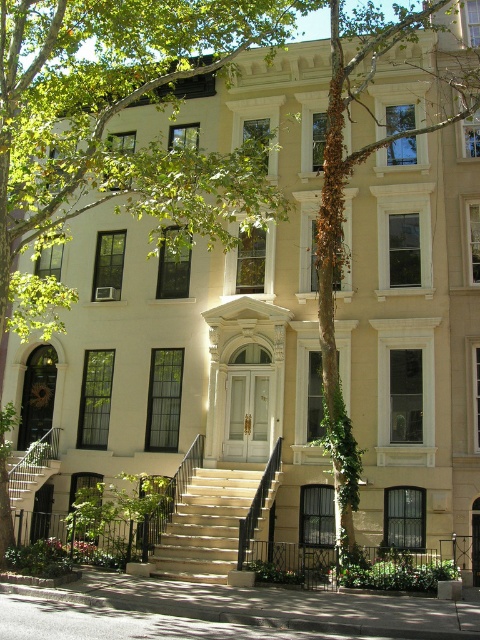
You are standing in front of the residential building and want to take a photo of both the green leafy tree at center and the metallic silver staircase at lower left. Which object should you focus on first to ensure both are in the frame?

You should focus on the green leafy tree at center first because it is closer to the viewer than the metallic silver staircase at lower left, so adjusting the camera to include it will naturally include the staircase in the background.

You are a delivery person trying to reach the front door of the beige stone building. You see the beige stone stairs at center and the metallic silver staircase at lower left. Which staircase is closer to the entrance?

The beige stone stairs at center is positioned under the metallic silver staircase at lower left, meaning it is closer to the entrance.

You are a visitor approaching the entrance of the building. You see the green leafy tree at center and the beige stone stairs at center. Which object is taller?

The green leafy tree at center is much taller than the beige stone stairs at center.